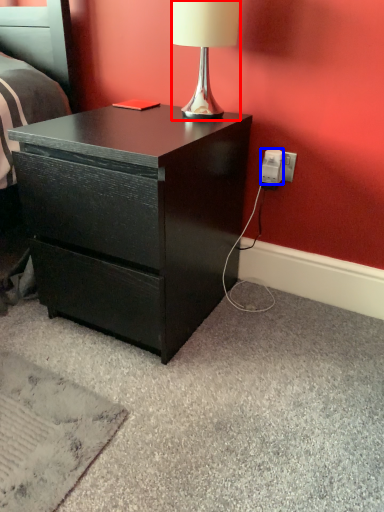
Question: Among these objects, which one is nearest to the camera, lamp (highlighted by a red box) or power outlet (highlighted by a blue box)?

Choices:
 (A) lamp
 (B) power outlet

Answer: (A)